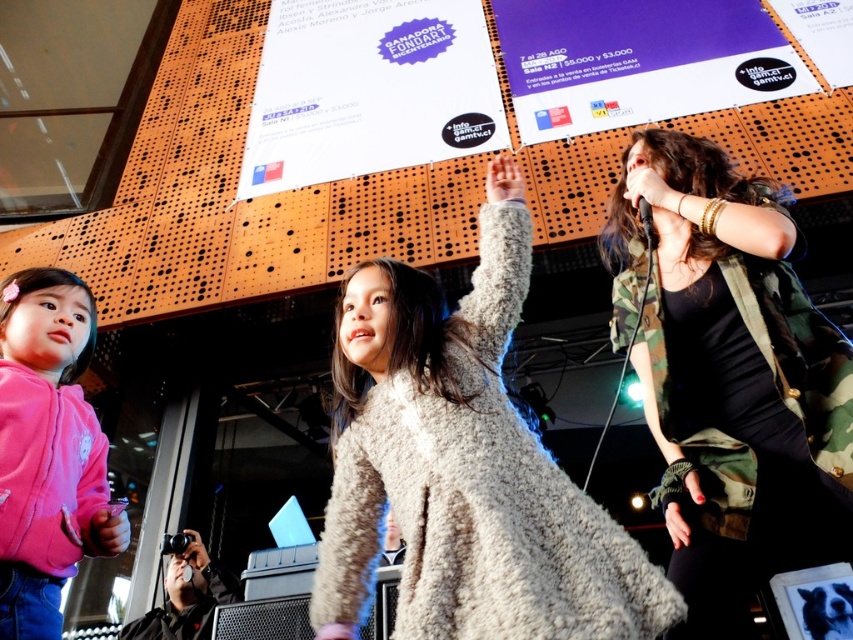
You are a photographer at the event and want to take a photo that includes both the orange paper poster at upper right and the light beige woolen sweater at upper center. Which object should you focus on first to ensure both are in focus?

You should focus on the light beige woolen sweater at upper center first because it is closer to the viewer than the orange paper poster at upper right. By focusing on the closer object, the poster in the background will still be in focus due to the depth of field.

You are a photographer standing at the front of the stage. You need to take a photo that includes both the purple paper poster at upper center and the orange paper poster at upper right. Which poster will appear closer to the camera in the photo?

The purple paper poster at upper center will appear closer to the camera in the photo because it is further to the viewer than the orange paper poster at upper right.

You are standing in the middle of the stage and want to move towards the point closer to the camera between point A at point [693,568] and point B at point [704,29]. Which point should you walk towards?

Point A at point [693,568] is closer to the camera than point B at point [704,29], so you should walk towards point A at point [693,568].